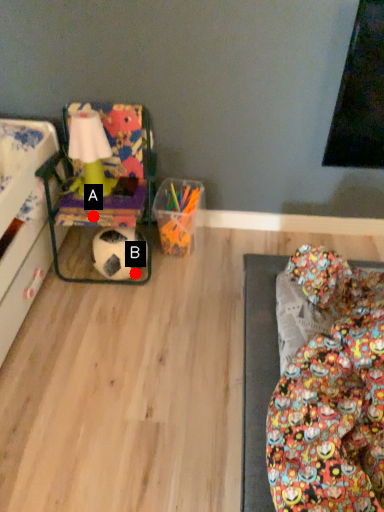
Question: Two points are circled on the image, labeled by A and B beside each circle. Among these points, which one is nearest to the camera?

Choices:
 (A) A is closer
 (B) B is closer

Answer: (A)